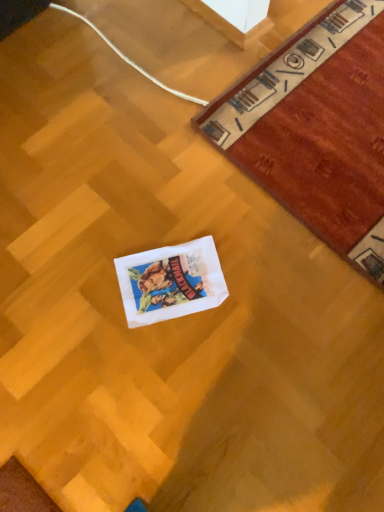
Identify the location of white paper postcard at center. (170, 282).

In order to face white paper postcard at center, should I rotate leftwards or rightwards?

A 2.749 degree turn to the left will do.

This screenshot has height=512, width=384. Describe the element at coordinates (170, 282) in the screenshot. I see `white paper postcard at center` at that location.

Identify the location of white paper postcard at center. (170, 282).